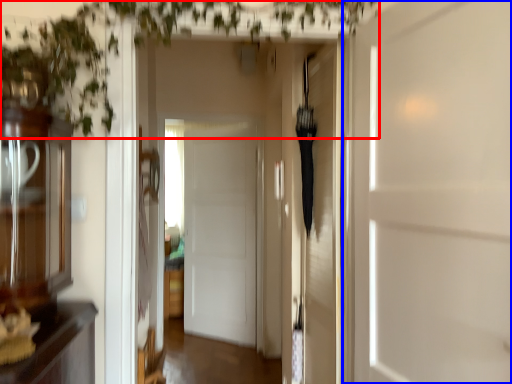
Question: Among these objects, which one is farthest to the camera, vegetation (highlighted by a red box) or door (highlighted by a blue box)?

Choices:
 (A) vegetation
 (B) door

Answer: (A)